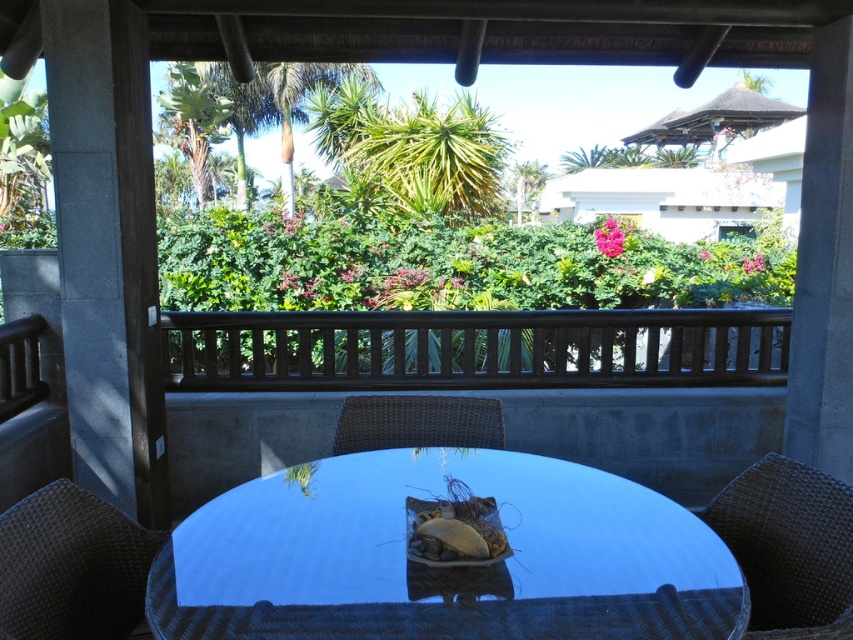
Between woven dark brown chair at lower right and green leafy palm tree at center, which one has more height?

green leafy palm tree at center is taller.

From the picture: Between woven dark brown chair at lower right and green leafy palm tree at center, which one appears on the left side from the viewer's perspective?

green leafy palm tree at center

Identify the location of woven dark brown chair at lower right. This screenshot has height=640, width=853. (788, 547).

Image resolution: width=853 pixels, height=640 pixels. Find the location of `woven dark brown chair at lower right`. woven dark brown chair at lower right is located at coordinates (788, 547).

Does woven dark brown chair at lower right have a lesser height compared to green leafy palm tree at upper left?

Indeed, woven dark brown chair at lower right has a lesser height compared to green leafy palm tree at upper left.

Based on the photo, is the position of woven dark brown chair at lower right more distant than that of green leafy palm tree at upper left?

That is False.

Identify the location of woven dark brown chair at lower right. The image size is (853, 640). (788, 547).

I want to click on woven dark brown chair at lower right, so click(x=788, y=547).

Which is more to the right, woven dark brown chair at lower left or green leafy palm tree at upper left?

From the viewer's perspective, woven dark brown chair at lower left appears more on the right side.

Between point (120, 595) and point (167, 129), which one is positioned behind?

The point (167, 129) is behind.

I want to click on woven dark brown chair at lower left, so click(73, 566).